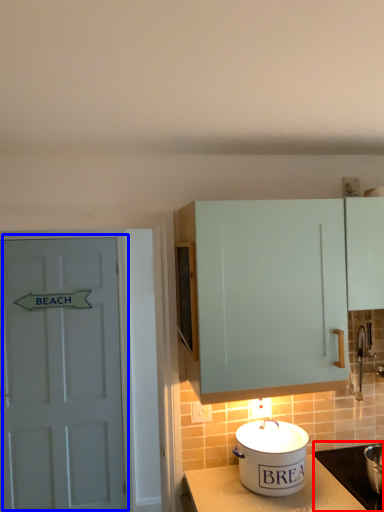
Question: Which point is closer to the camera, appliance (highlighted by a red box) or door (highlighted by a blue box)?

Choices:
 (A) appliance
 (B) door

Answer: (A)